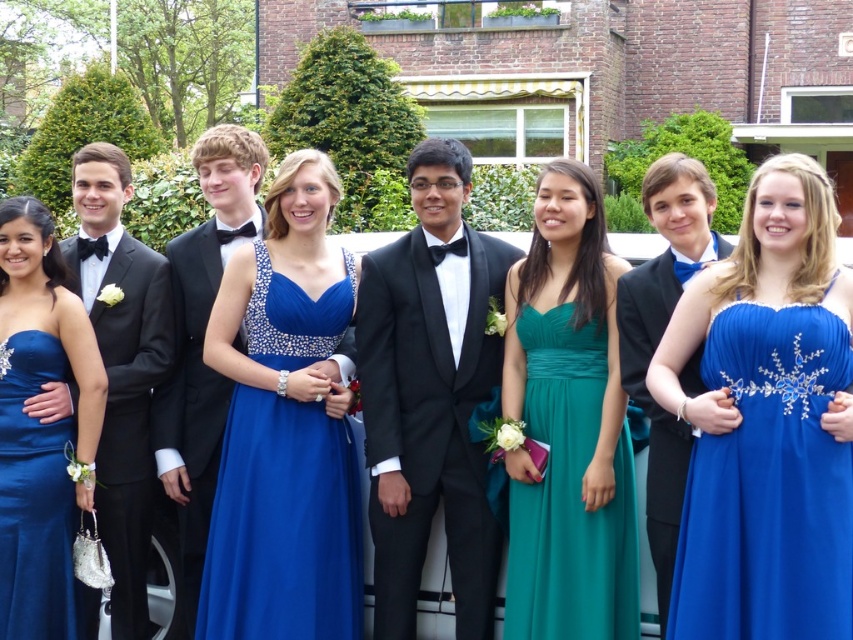
You are a photographer trying to focus on the black satin tuxedo at center. What are the coordinates where you should aim your camera?

The black satin tuxedo at center is located at coordinates point (430, 394) so you should aim your camera there.

You are a photographer trying to adjust the spacing between the black satin tuxedo at left and the matte black suit at center so that they are equidistant from the camera. Given their sizes, which one should you move closer to the camera?

The black satin tuxedo at left is larger in size than the matte black suit at center, so you should move the black satin tuxedo at left closer to the camera to make them appear the same size.

You are a photographer trying to capture a closeup of the matte black suit at center without including the black satin tuxedo at left in the frame. Based on their positions, is this possible?

The black satin tuxedo at left is to the left of matte black suit at center, so if you position the camera to focus on the matte black suit at center and frame the shot to exclude the left side, it should be possible to capture a closeup of the matte black suit at center without including the black satin tuxedo at left.